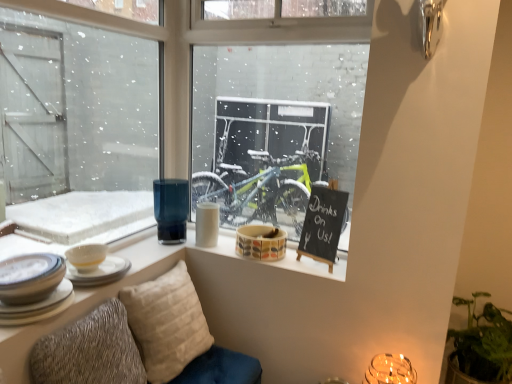
Where is `vacant region above white ceramic plates at lower left, the 2th tableware from the left (from a real-world perspective)`? The image size is (512, 384). vacant region above white ceramic plates at lower left, the 2th tableware from the left (from a real-world perspective) is located at coordinates point(27,255).